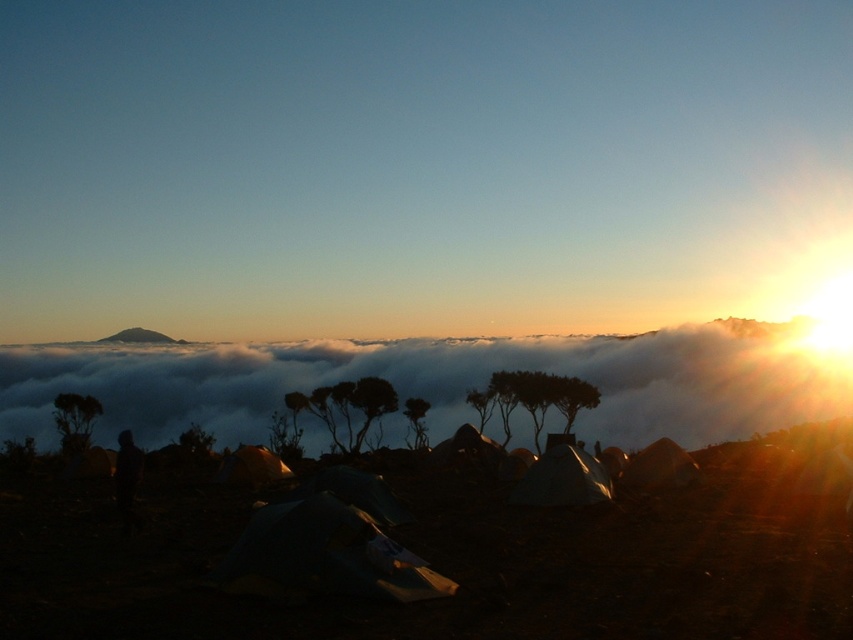
Does matte silver tent at lower right appear under white fabric tent at lower right?

No, matte silver tent at lower right is not below white fabric tent at lower right.

Does point (538, 474) come closer to viewer compared to point (643, 456)?

Yes, point (538, 474) is in front of point (643, 456).

Find the location of `matte silver tent at lower right`. matte silver tent at lower right is located at coordinates (561, 480).

The width and height of the screenshot is (853, 640). What do you see at coordinates (444, 380) in the screenshot?
I see `white fluffy cloud at center` at bounding box center [444, 380].

This screenshot has width=853, height=640. Identify the location of white fluffy cloud at center. (444, 380).

Is green fabric tent at center bigger than dark fabric figure at lower center?

No.

Between green fabric tent at center and dark fabric figure at lower center, which one is positioned higher?

green fabric tent at center is above.

Measure the distance between point (366, 554) and camera.

26.66 feet

Identify the location of green fabric tent at center. (323, 556).